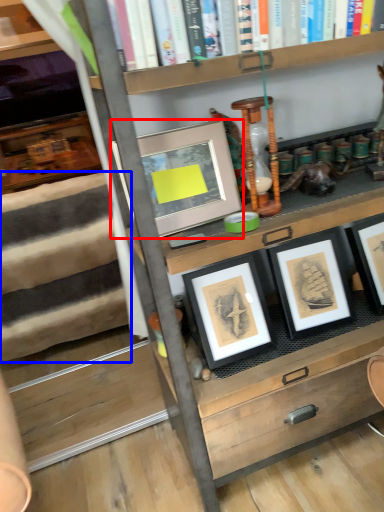
Question: Which of the following is the farthest to the observer, picture frame (highlighted by a red box) or stair (highlighted by a blue box)?

Choices:
 (A) picture frame
 (B) stair

Answer: (B)